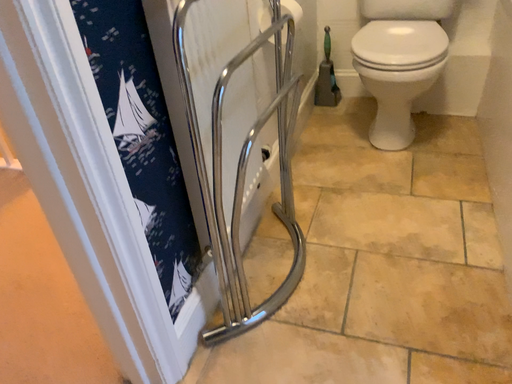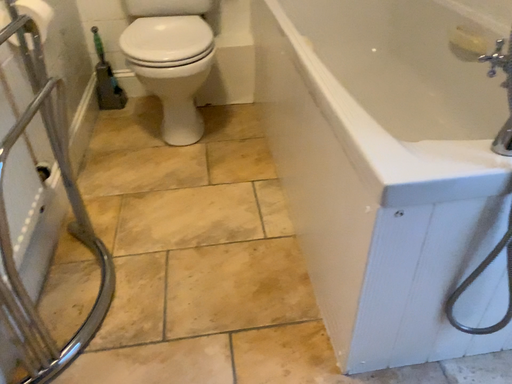
Question: How did the camera likely rotate when shooting the video?

Choices:
 (A) rotated left
 (B) rotated right

Answer: (B)